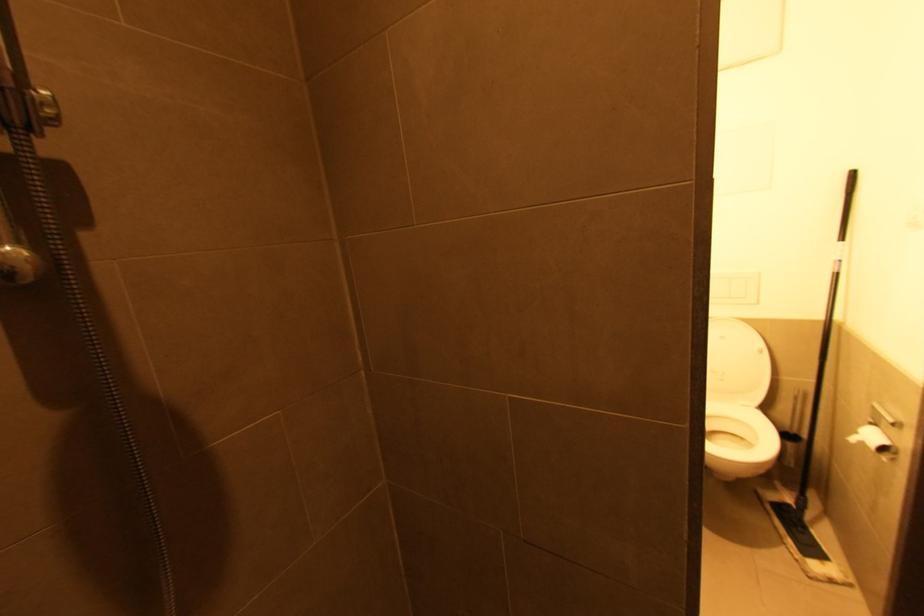
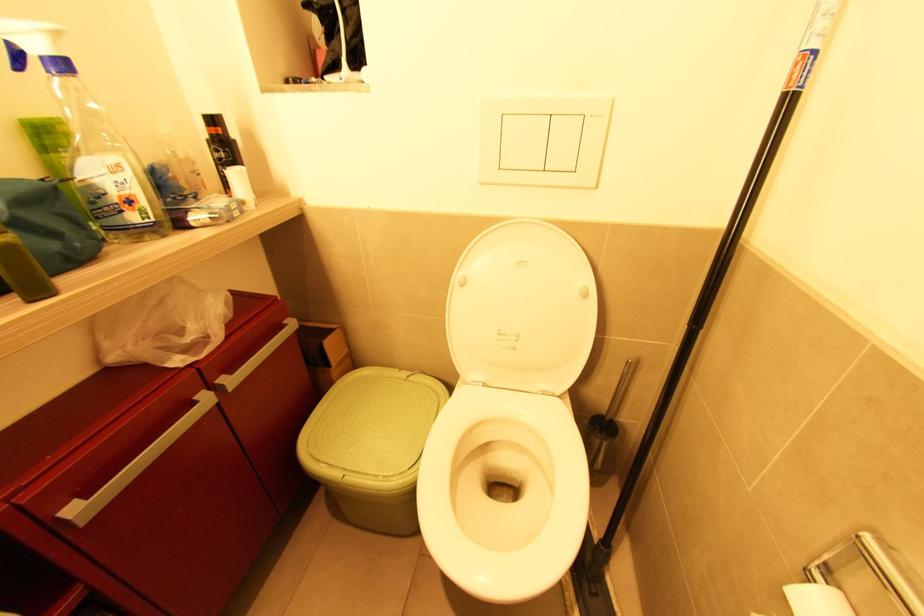
In a continuous first-person perspective shot, in which direction is the camera moving?

The cameraman moved toward right, forward.